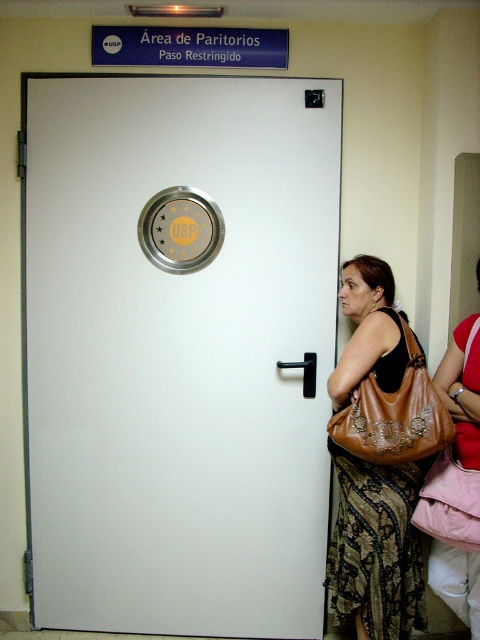
Question: Which of the following is the farthest from the observer?

Choices:
 (A) (180, 369)
 (B) (361, 620)
 (C) (360, 380)

Answer: (A)

Question: Which point is closer to the camera?

Choices:
 (A) (389, 476)
 (B) (418, 448)

Answer: (B)

Question: Which object is farther from the camera taking this photo?

Choices:
 (A) white glossy door at center
 (B) brown leather purse at right

Answer: (A)

Question: Is white glossy door at center closer to camera compared to brown leather bag at right?

Choices:
 (A) yes
 (B) no

Answer: (B)

Question: Is brown leather purse at right further to the viewer compared to brown leather bag at right?

Choices:
 (A) yes
 (B) no

Answer: (A)

Question: Does white glossy door at center appear over brown leather bag at right?

Choices:
 (A) no
 (B) yes

Answer: (B)